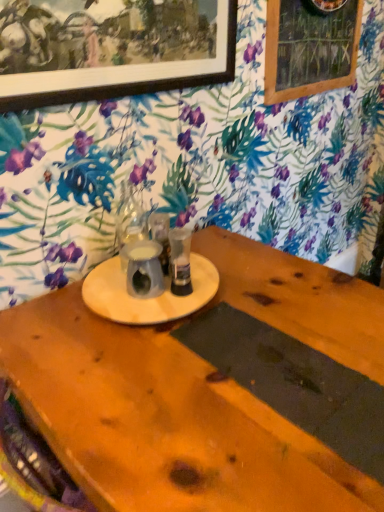
Question: Should I look upward or downward to see metallic silver cup at center, the 1th tableware from the right?

Choices:
 (A) down
 (B) up

Answer: (B)

Question: Can you confirm if metallic silver cup at center, the 1th tableware from the right, is taller than wooden frame at upper right?

Choices:
 (A) yes
 (B) no

Answer: (B)

Question: From a real-world perspective, is metallic silver cup at center, the 1th tableware from the right, on wooden frame at upper right?

Choices:
 (A) no
 (B) yes

Answer: (A)

Question: Is the position of metallic silver cup at center, acting as the 2th tableware starting from the left, more distant than that of wooden frame at upper right?

Choices:
 (A) no
 (B) yes

Answer: (A)

Question: Is there a large distance between metallic silver cup at center, acting as the 2th tableware starting from the left, and wooden frame at upper right?

Choices:
 (A) no
 (B) yes

Answer: (A)

Question: Is metallic silver cup at center, acting as the 2th tableware starting from the left, at the right side of wooden frame at upper right?

Choices:
 (A) no
 (B) yes

Answer: (A)

Question: Considering the relative sizes of metallic silver cup at center, acting as the 2th tableware starting from the left, and wooden frame at upper right in the image provided, is metallic silver cup at center, acting as the 2th tableware starting from the left, wider than wooden frame at upper right?

Choices:
 (A) no
 (B) yes

Answer: (B)

Question: Is wooden frame at upper right positioned with its back to metallic silver cup at center, acting as the 2th tableware starting from the left?

Choices:
 (A) yes
 (B) no

Answer: (B)

Question: Is wooden frame at upper right positioned behind metallic silver cup at center, the 1th tableware from the right?

Choices:
 (A) yes
 (B) no

Answer: (A)

Question: Does wooden frame at upper right have a greater width compared to metallic silver cup at center, acting as the 2th tableware starting from the left?

Choices:
 (A) yes
 (B) no

Answer: (B)

Question: From a real-world perspective, is wooden frame at upper right physically below metallic silver cup at center, the 1th tableware from the right?

Choices:
 (A) no
 (B) yes

Answer: (A)

Question: Is the depth of wooden frame at upper right less than that of metallic silver cup at center, acting as the 2th tableware starting from the left?

Choices:
 (A) yes
 (B) no

Answer: (B)

Question: Is wooden frame at upper right not close to metallic silver cup at center, the 1th tableware from the right?

Choices:
 (A) no
 (B) yes

Answer: (A)

Question: Is wooden picture frame at upper left shorter than metallic silver cup at center, the 1th tableware from the right?

Choices:
 (A) no
 (B) yes

Answer: (A)